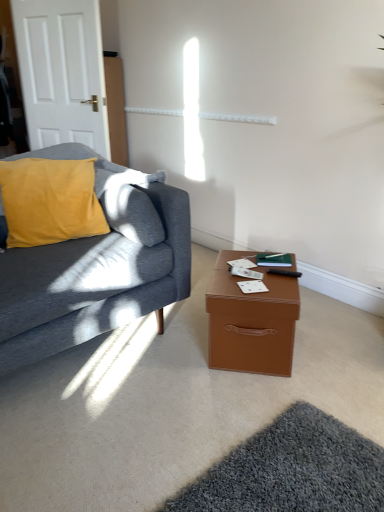
Question: Is black plastic remote control at lower right facing towards brown leather-like box at lower right?

Choices:
 (A) yes
 (B) no

Answer: (B)

Question: Is black plastic remote control at lower right shorter than brown leather-like box at lower right?

Choices:
 (A) yes
 (B) no

Answer: (A)

Question: Can we say black plastic remote control at lower right lies outside brown leather-like box at lower right?

Choices:
 (A) no
 (B) yes

Answer: (B)

Question: Can you confirm if black plastic remote control at lower right is wider than brown leather-like box at lower right?

Choices:
 (A) no
 (B) yes

Answer: (A)

Question: From a real-world perspective, is black plastic remote control at lower right over brown leather-like box at lower right?

Choices:
 (A) no
 (B) yes

Answer: (B)

Question: From a real-world perspective, is velvet yellow pillow at left above or below brown leather-like box at lower right?

Choices:
 (A) above
 (B) below

Answer: (A)

Question: From the image's perspective, is velvet yellow pillow at left located above or below brown leather-like box at lower right?

Choices:
 (A) above
 (B) below

Answer: (A)

Question: Is velvet yellow pillow at left bigger or smaller than brown leather-like box at lower right?

Choices:
 (A) big
 (B) small

Answer: (A)

Question: In the image, is velvet yellow pillow at left positioned in front of or behind brown leather-like box at lower right?

Choices:
 (A) behind
 (B) front

Answer: (A)

Question: From the image's perspective, is velvet yellow pillow at left above or below velvet mustard pillow at left?

Choices:
 (A) above
 (B) below

Answer: (A)

Question: Considering the positions of point (74, 180) and point (29, 340), is point (74, 180) closer or farther from the camera than point (29, 340)?

Choices:
 (A) farther
 (B) closer

Answer: (A)

Question: Would you say velvet yellow pillow at left is to the left or to the right of velvet mustard pillow at left in the picture?

Choices:
 (A) right
 (B) left

Answer: (A)

Question: Considering the positions of velvet yellow pillow at left and velvet mustard pillow at left in the image, is velvet yellow pillow at left bigger or smaller than velvet mustard pillow at left?

Choices:
 (A) small
 (B) big

Answer: (A)

Question: Looking at the image, does velvet mustard pillow at left seem bigger or smaller compared to black plastic remote control at lower right?

Choices:
 (A) small
 (B) big

Answer: (B)

Question: From a real-world perspective, is velvet mustard pillow at left positioned above or below black plastic remote control at lower right?

Choices:
 (A) below
 (B) above

Answer: (B)